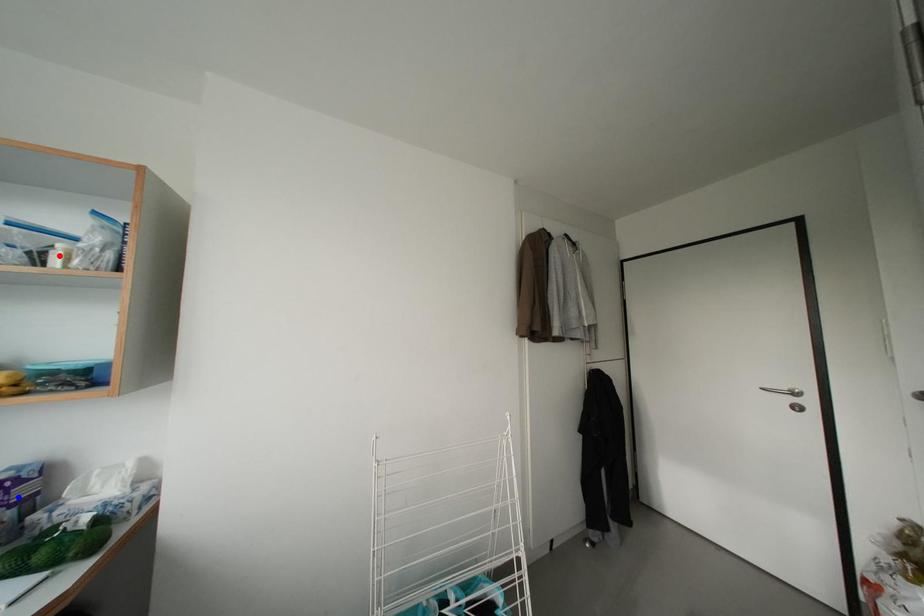
Question: In the image, two points are highlighted. Which point is nearer to the camera? Reply with the corresponding letter.

Choices:
 (A) blue point
 (B) red point

Answer: (A)